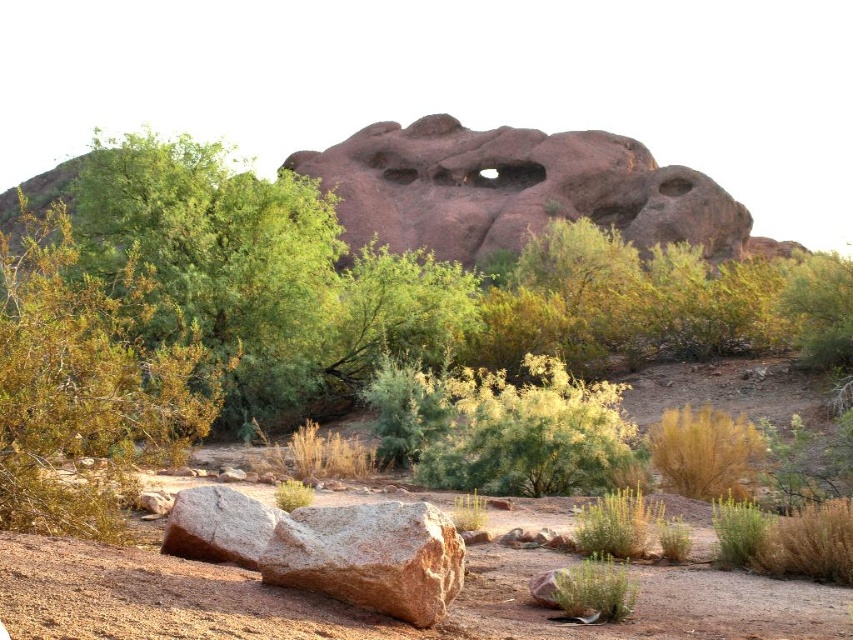
Describe the element at coordinates (514, 189) in the screenshot. This screenshot has height=640, width=853. I see `rusty brown rock at center` at that location.

Based on the photo, does rusty brown rock at center have a greater height compared to brown rough boulder at lower left?

Indeed, rusty brown rock at center has a greater height compared to brown rough boulder at lower left.

The image size is (853, 640). Identify the location of rusty brown rock at center. (514, 189).

Is green leafy bush at left to the left of brown rough boulder at lower left from the viewer's perspective?

Correct, you'll find green leafy bush at left to the left of brown rough boulder at lower left.

Does green leafy bush at left appear on the right side of brown rough boulder at lower left?

In fact, green leafy bush at left is to the left of brown rough boulder at lower left.

Does point (55, 456) lie in front of point (384, 552)?

No.

This screenshot has height=640, width=853. What are the coordinates of `green leafy bush at left` in the screenshot? It's located at (86, 384).

Describe the element at coordinates (86, 384) in the screenshot. Image resolution: width=853 pixels, height=640 pixels. I see `green leafy bush at left` at that location.

Does green leafy bush at left come behind rusty brown rock at center?

No.

This screenshot has width=853, height=640. I want to click on green leafy bush at left, so click(86, 384).